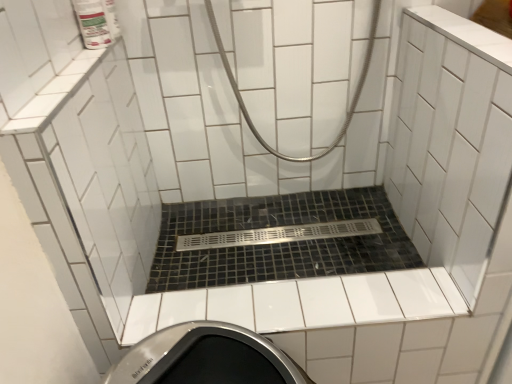
Looking at this image, what is the approximate height of satin silver drain at center?

It is 3.11 inches.

Where is `satin silver drain at center`? Image resolution: width=512 pixels, height=384 pixels. satin silver drain at center is located at coordinates (280, 243).

The image size is (512, 384). Describe the element at coordinates (280, 243) in the screenshot. I see `satin silver drain at center` at that location.

In order to face satin silver drain at center, should I rotate leftwards or rightwards?

You should rotate right by 3.305 degrees.

You are a GUI agent. You are given a task and a screenshot of the screen. Output one action in this format:
    pyautogui.click(x=<x>, y=<y>)
    Task: Click on the satin silver drain at center
    Image resolution: width=512 pixels, height=384 pixels.
    Given the screenshot: What is the action you would take?
    pyautogui.click(x=280, y=243)